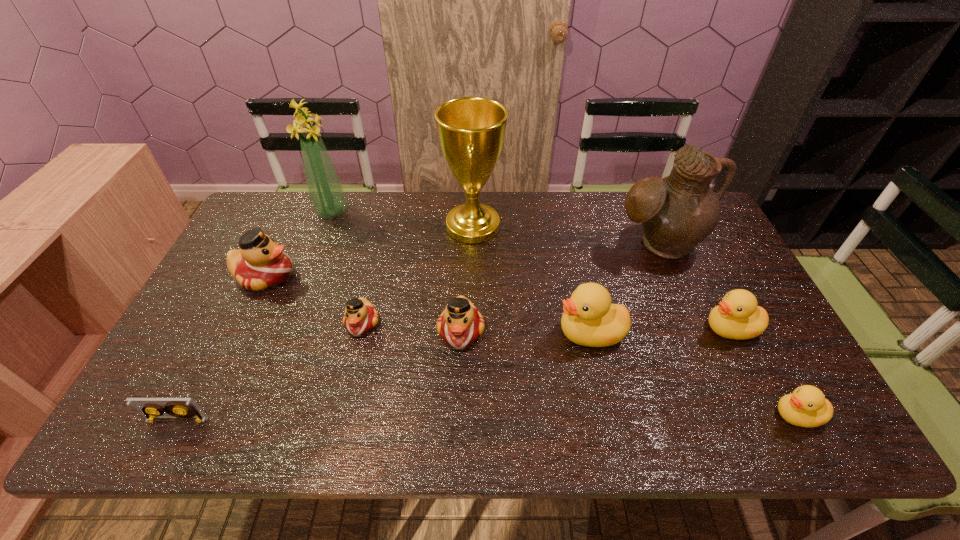
I want to click on empty space between the videotape and the second red duck from right to left, so click(x=270, y=372).

Identify the location of free area in between the farthest duck and the green bouquet. The width and height of the screenshot is (960, 540). (299, 244).

Find the location of a particular element. vacant area that lies between the leftmost red duck and the pitcher is located at coordinates (463, 260).

Image resolution: width=960 pixels, height=540 pixels. Find the location of `vacant area that lies between the second smallest yellow duck and the award`. vacant area that lies between the second smallest yellow duck and the award is located at coordinates (602, 278).

The height and width of the screenshot is (540, 960). Find the location of `vacant region between the second smallest yellow duck and the green bouquet`. vacant region between the second smallest yellow duck and the green bouquet is located at coordinates (531, 270).

You are a GUI agent. You are given a task and a screenshot of the screen. Output one action in this format:
    pyautogui.click(x=<x>, y=<y>)
    Task: Click on the vacant area between the fourth object from left to right and the shortest object
    
    Given the screenshot: What is the action you would take?
    pyautogui.click(x=270, y=372)

Where is `blank region between the brown pitcher and the smallest red duck`? blank region between the brown pitcher and the smallest red duck is located at coordinates (511, 284).

Find the location of a particular element. the sixth closest object to the nearest duck is located at coordinates (360, 316).

Find the location of `the sixth closest object relative to the second biggest yellow duck`. the sixth closest object relative to the second biggest yellow duck is located at coordinates (360, 316).

The image size is (960, 540). What are the coordinates of `duck that stands as the closest to the third duck from left to right` in the screenshot? It's located at (360, 316).